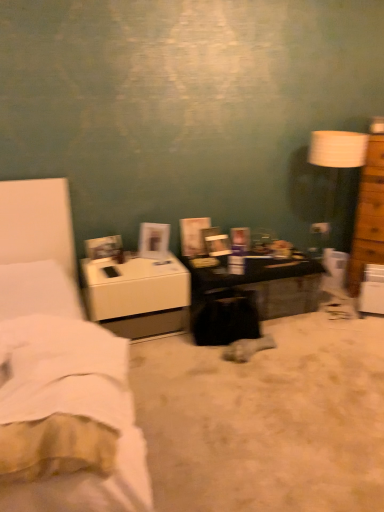
Describe the element at coordinates (266, 419) in the screenshot. Image resolution: width=384 pixels, height=512 pixels. I see `black fabric bag at center` at that location.

Locate an element on the screen. white fabric bed at left is located at coordinates (69, 404).

From the image's perspective, is white fabric bed at left above brown wooden chest of drawers at right?

No, from the image's perspective, white fabric bed at left is not above brown wooden chest of drawers at right.

Considering the sizes of objects white fabric bed at left and brown wooden chest of drawers at right in the image provided, who is taller, white fabric bed at left or brown wooden chest of drawers at right?

brown wooden chest of drawers at right is taller.

Is brown wooden chest of drawers at right inside white fabric bed at left?

No, brown wooden chest of drawers at right is not inside white fabric bed at left.

From a real-world perspective, which is physically below, white fabric bed at left or brown wooden chest of drawers at right?

In real-world perspective, white fabric bed at left is lower.

Considering their positions, is white soft fabric bedsheet at lower left located in front of or behind black fabric bag at center?

Clearly, white soft fabric bedsheet at lower left is in front of black fabric bag at center.

From a real-world perspective, is white soft fabric bedsheet at lower left located beneath black fabric bag at center?

Incorrect, from a real-world perspective, white soft fabric bedsheet at lower left is higher than black fabric bag at center.

Is white soft fabric bedsheet at lower left not close to black fabric bag at center?

That's not correct — white soft fabric bedsheet at lower left is a little close to black fabric bag at center.

This screenshot has width=384, height=512. I want to click on sheet above the black fabric bag at center (from a real-world perspective), so click(x=61, y=396).

From a real-world perspective, does black fabric swivel chair at center stand above white glossy nightstand at left?

No, from a real-world perspective, black fabric swivel chair at center is not on top of white glossy nightstand at left.

Can you confirm if black fabric swivel chair at center is positioned to the left of white glossy nightstand at left?

In fact, black fabric swivel chair at center is to the right of white glossy nightstand at left.

Is black fabric swivel chair at center aimed at white glossy nightstand at left?

No, black fabric swivel chair at center is not aimed at white glossy nightstand at left.

Based on the photo, is white glossy nightstand at left inside the boundaries of black fabric bag at center, or outside?

white glossy nightstand at left is not enclosed by black fabric bag at center.

How much distance is there between white glossy nightstand at left and black fabric bag at center?

white glossy nightstand at left is 23.32 inches from black fabric bag at center.

Considering the positions of objects white glossy nightstand at left and black fabric bag at center in the image provided, who is more to the right, white glossy nightstand at left or black fabric bag at center?

black fabric bag at center.

Is white glossy nightstand at left facing away from black fabric bag at center?

No, white glossy nightstand at left's orientation is not away from black fabric bag at center.

How many degrees apart are the facing directions of brown wooden chest of drawers at right and black fabric swivel chair at center?

The angle between the facing direction of brown wooden chest of drawers at right and the facing direction of black fabric swivel chair at center is 26.2 degrees.

Considering the relative positions of brown wooden chest of drawers at right and black fabric swivel chair at center in the image provided, is brown wooden chest of drawers at right to the left or to the right of black fabric swivel chair at center?

Based on their positions, brown wooden chest of drawers at right is located to the right of black fabric swivel chair at center.

Considering the positions of objects brown wooden chest of drawers at right and black fabric swivel chair at center in the image provided, who is in front, brown wooden chest of drawers at right or black fabric swivel chair at center?

Positioned in front is black fabric swivel chair at center.

In the scene shown: Is black fabric swivel chair at center oriented away from white soft fabric bedsheet at lower left?

That's not correct — black fabric swivel chair at center is not looking away from white soft fabric bedsheet at lower left.

Between black fabric swivel chair at center and white soft fabric bedsheet at lower left, which one appears on the right side from the viewer's perspective?

Positioned to the right is black fabric swivel chair at center.

Relative to white soft fabric bedsheet at lower left, is black fabric swivel chair at center in front or behind?

In the image, black fabric swivel chair at center appears behind white soft fabric bedsheet at lower left.

Considering the positions of point (251, 307) and point (85, 383), is point (251, 307) closer or farther from the camera than point (85, 383)?

Clearly, point (251, 307) is more distant from the camera than point (85, 383).

Between point (122, 384) and point (0, 387), which one is positioned behind?

Positioned behind is point (122, 384).

Considering the sizes of white soft fabric bedsheet at lower left and white fabric bed at left in the image, is white soft fabric bedsheet at lower left taller or shorter than white fabric bed at left?

Considering their sizes, white soft fabric bedsheet at lower left has less height than white fabric bed at left.

Where is `sheet above the white fabric bed at left (from a real-world perspective)`? The image size is (384, 512). sheet above the white fabric bed at left (from a real-world perspective) is located at coordinates (61, 396).

From a real-world perspective, is white soft fabric bedsheet at lower left physically below white fabric bed at left?

No, from a real-world perspective, white soft fabric bedsheet at lower left is not beneath white fabric bed at left.

In the image, there is a brown wooden chest of drawers at right. Where is `bed below it (from the image's perspective)`? This screenshot has height=512, width=384. bed below it (from the image's perspective) is located at coordinates (69, 404).

I want to click on plain below the white soft fabric bedsheet at lower left (from a real-world perspective), so click(x=266, y=419).

Estimate the real-world distances between objects in this image. Which object is closer to brown wooden chest of drawers at right, black fabric swivel chair at center or dark brown wooden desk at center?

dark brown wooden desk at center is closer to brown wooden chest of drawers at right.

Estimate the real-world distances between objects in this image. Which object is further from black fabric swivel chair at center, black fabric bag at center or white fabric bed at left?

Based on the image, white fabric bed at left appears to be further to black fabric swivel chair at center.

Estimate the real-world distances between objects in this image. Which object is further from white fabric bed at left, dark brown wooden desk at center or white soft fabric bedsheet at lower left?

dark brown wooden desk at center is further to white fabric bed at left.

Looking at the image, which one is located closer to white glossy nightstand at left, black fabric swivel chair at center or dark brown wooden desk at center?

Answer: Based on the image, black fabric swivel chair at center appears to be nearer to white glossy nightstand at left.

Considering their positions, is dark brown wooden desk at center positioned further to white soft fabric bedsheet at lower left than brown wooden chest of drawers at right?

brown wooden chest of drawers at right lies further to white soft fabric bedsheet at lower left than the other object.

Which object lies further to the anchor point black fabric swivel chair at center, dark brown wooden desk at center or white glossy nightstand at left?

white glossy nightstand at left is further to black fabric swivel chair at center.

Estimate the real-world distances between objects in this image. Which object is closer to black fabric bag at center, white soft fabric bedsheet at lower left or black fabric swivel chair at center?

black fabric swivel chair at center is closer to black fabric bag at center.

Considering their positions, is black fabric bag at center positioned closer to black fabric swivel chair at center than white soft fabric bedsheet at lower left?

Based on the image, black fabric bag at center appears to be nearer to black fabric swivel chair at center.

I want to click on nightstand located between white soft fabric bedsheet at lower left and dark brown wooden desk at center in the depth direction, so click(138, 295).

Find the location of a particular element. The height and width of the screenshot is (512, 384). nightstand between black fabric bag at center and dark brown wooden desk at center along the z-axis is located at coordinates click(x=138, y=295).

I want to click on swivel chair between white glossy nightstand at left and dark brown wooden desk at center in the horizontal direction, so click(x=226, y=318).

This screenshot has width=384, height=512. Find the location of `swivel chair located between black fabric bag at center and dark brown wooden desk at center in the depth direction`. swivel chair located between black fabric bag at center and dark brown wooden desk at center in the depth direction is located at coordinates (226, 318).